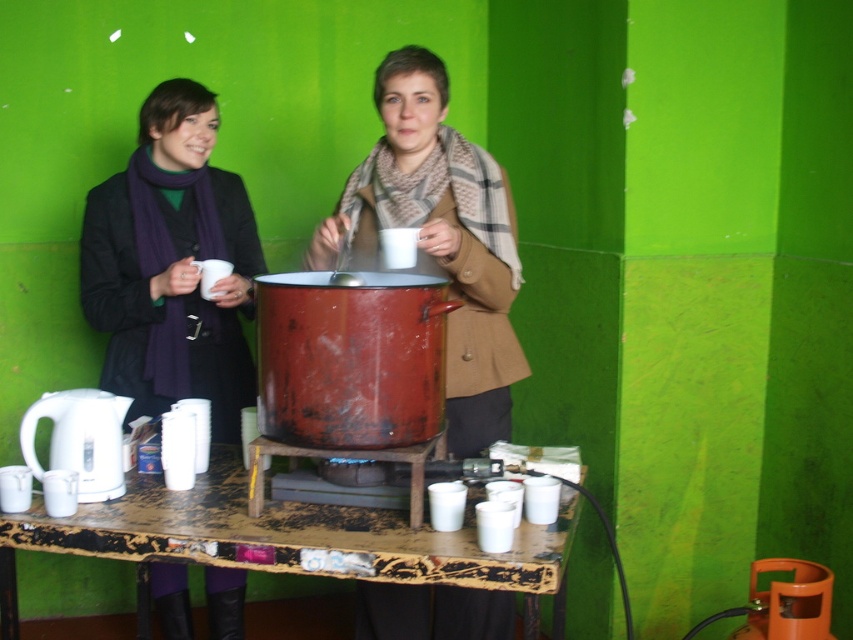
You are standing in the room and want to reach the point at coordinates (479,346). The stove is in your way. Can you step around the stove to reach the point?

The point at coordinates (479,346) is 7.30 feet from the camera, so you can step around the stove to reach it.

You are organizing a fashion show and need to decide which scarf to feature based on their widths. Given that the purple scarf at left is narrower than the plaid scarf at center, which scarf should you choose if you want the wider one?

The plaid scarf at center is wider than the purple scarf at left, so you should choose the plaid scarf at center for the wider option.

You are a guest in this room and need to reach the white plastic kettle at lower left without moving the plaid scarf at center. Is this possible?

The plaid scarf at center is above the white plastic kettle at lower left, so you can reach the white plastic kettle at lower left by going around or underneath the plaid scarf at center since it is positioned above it.